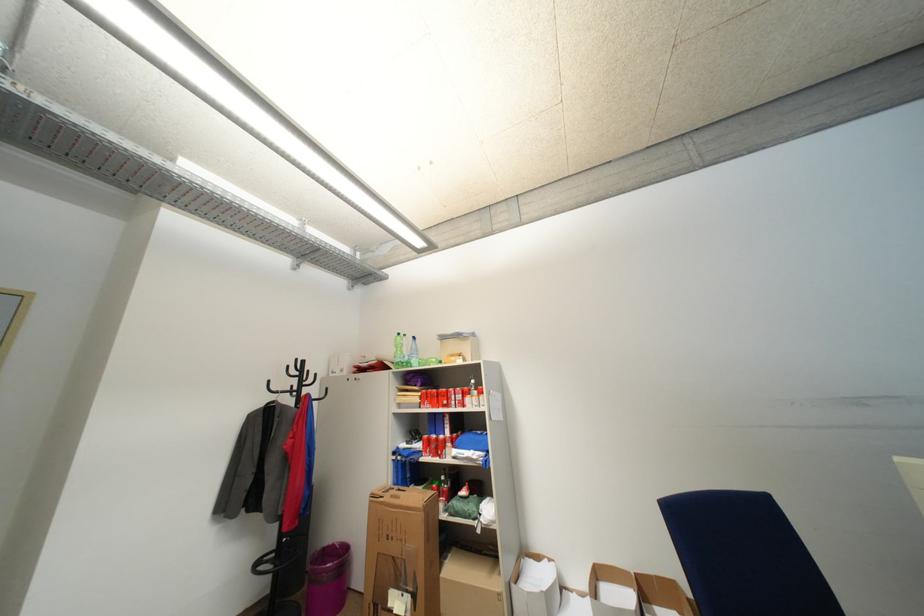
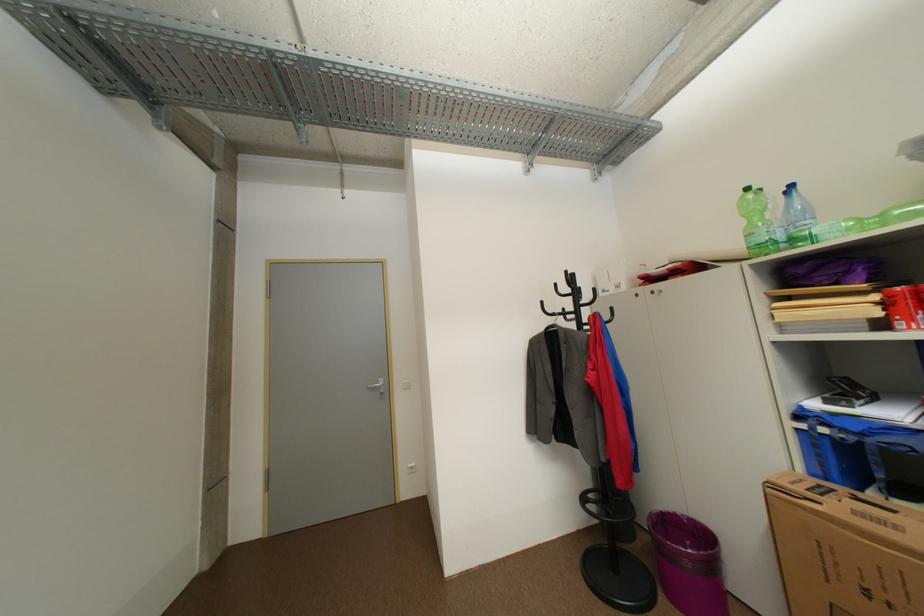
Question: Based on the continuous images, in which direction is the camera rotating? Reply with the corresponding letter.

Choices:
 (A) Left
 (B) Right
 (C) Up
 (D) Down

Answer: (A)